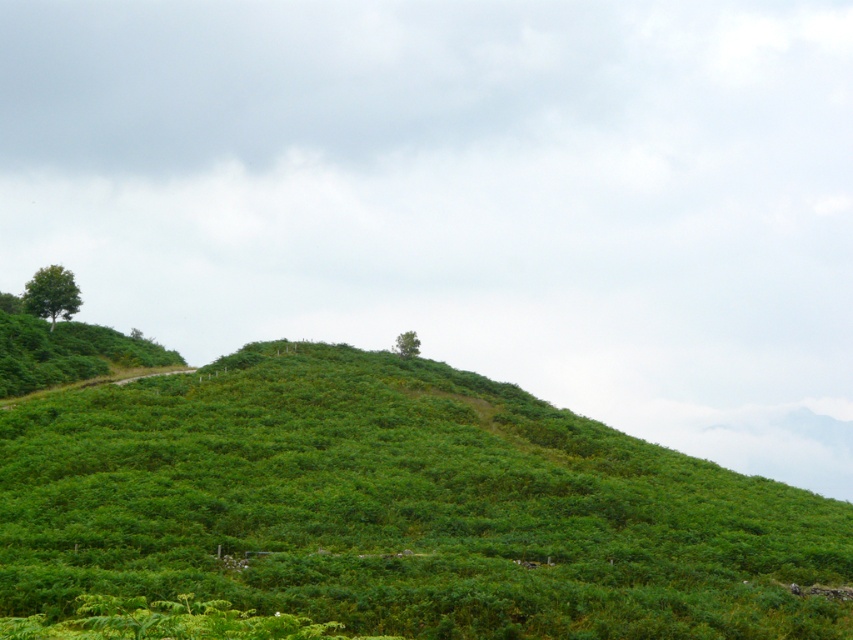
The height and width of the screenshot is (640, 853). Identify the location of green leafy tree at upper left. (51, 292).

Between green leafy tree at upper left and green leafy tree at upper center, which one is positioned lower?

green leafy tree at upper center is below.

Locate an element on the screen. Image resolution: width=853 pixels, height=640 pixels. green leafy tree at upper left is located at coordinates (51, 292).

From the picture: Is green leafy hillside at center further to camera compared to green leafy tree at upper left?

That is False.

Which is above, green leafy hillside at center or green leafy tree at upper left?

green leafy tree at upper left is higher up.

Between point (505, 522) and point (54, 276), which one is positioned behind?

Point (54, 276)

Locate an element on the screen. green leafy hillside at center is located at coordinates (399, 508).

Is green leafy hillside at center thinner than green leafy tree at upper center?

No, green leafy hillside at center is not thinner than green leafy tree at upper center.

Between green leafy hillside at center and green leafy tree at upper center, which one is positioned higher?

green leafy tree at upper center is above.

Locate an element on the screen. The image size is (853, 640). green leafy hillside at center is located at coordinates (399, 508).

This screenshot has height=640, width=853. I want to click on green leafy hillside at center, so click(x=399, y=508).